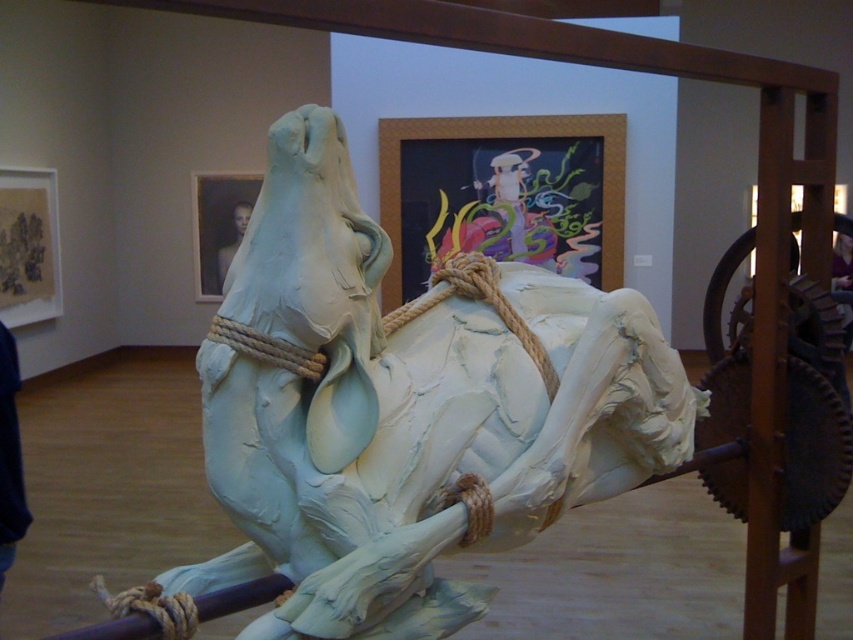
Which is more to the left, white clay horse at center or roperoughrope at center?

white clay horse at center

Between white clay horse at center and roperoughrope at center, which one appears on the right side from the viewer's perspective?

roperoughrope at center is more to the right.

Between point (410, 602) and point (440, 282), which one is positioned behind?

The point (440, 282) is behind.

Locate an element on the screen. The image size is (853, 640). white clay horse at center is located at coordinates (407, 408).

Between point (485, 419) and point (242, 225), which one is positioned in front?

Point (485, 419) is in front.

This screenshot has height=640, width=853. Describe the element at coordinates (407, 408) in the screenshot. I see `white clay horse at center` at that location.

Locate an element on the screen. The width and height of the screenshot is (853, 640). white clay horse at center is located at coordinates (407, 408).

Can you confirm if roperoughrope at center is positioned to the left of smooth skin man at upper center?

Incorrect, roperoughrope at center is not on the left side of smooth skin man at upper center.

Does roperoughrope at center have a smaller size compared to smooth skin man at upper center?

Yes.

Locate an element on the screen. The width and height of the screenshot is (853, 640). roperoughrope at center is located at coordinates (477, 300).